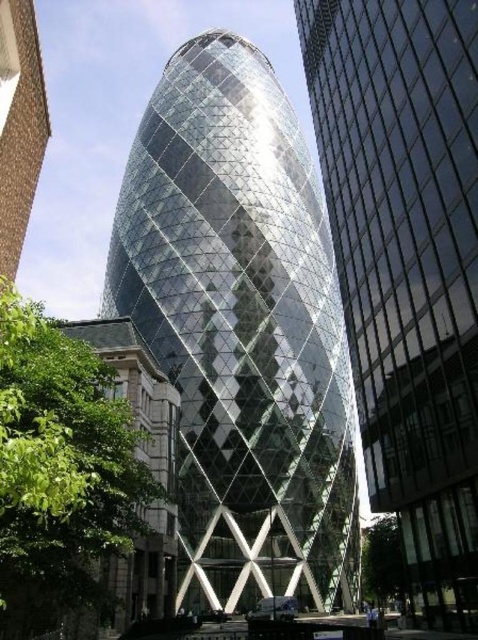
Question: Can you confirm if green leafy tree at lower left is positioned above green leafy tree at lower right?

Choices:
 (A) yes
 (B) no

Answer: (A)

Question: Which object is farther from the camera taking this photo?

Choices:
 (A) transparent glass tower at center
 (B) green leafy tree at lower right
 (C) transparent glass skyscraper at center
 (D) green leafy tree at lower left

Answer: (A)

Question: In this image, where is transparent glass skyscraper at center located relative to green leafy tree at lower right?

Choices:
 (A) below
 (B) above

Answer: (B)

Question: Which object is the farthest from the transparent glass tower at center?

Choices:
 (A) green leafy tree at lower left
 (B) transparent glass skyscraper at center

Answer: (A)

Question: Which of the following is the closest to the observer?

Choices:
 (A) transparent glass tower at center
 (B) green leafy tree at lower right
 (C) transparent glass skyscraper at center

Answer: (C)

Question: Does green leafy tree at lower left lie in front of green leafy tree at lower right?

Choices:
 (A) yes
 (B) no

Answer: (A)